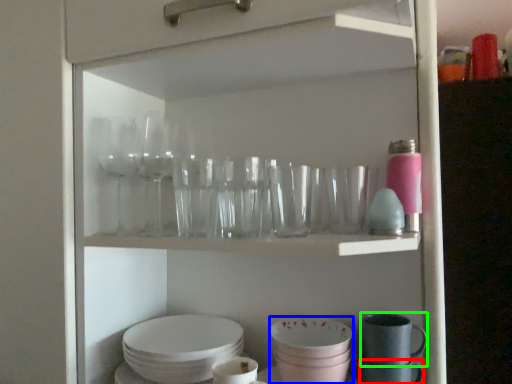
Question: Which object is positioned closest to tableware (highlighted by a red box)? Select from tableware (highlighted by a blue box) and tableware (highlighted by a green box).

Choices:
 (A) tableware
 (B) tableware

Answer: (B)